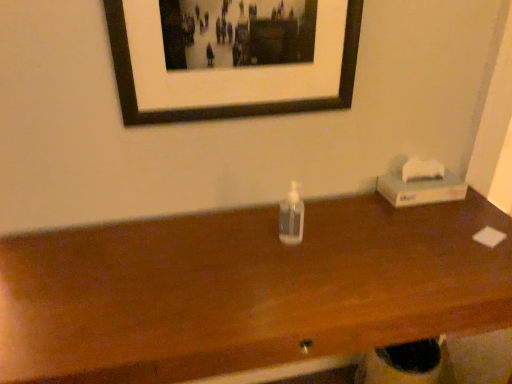
Locate an element on the screen. Image resolution: width=512 pixels, height=384 pixels. unoccupied region to the right of white cardboard tissue box at right is located at coordinates (475, 205).